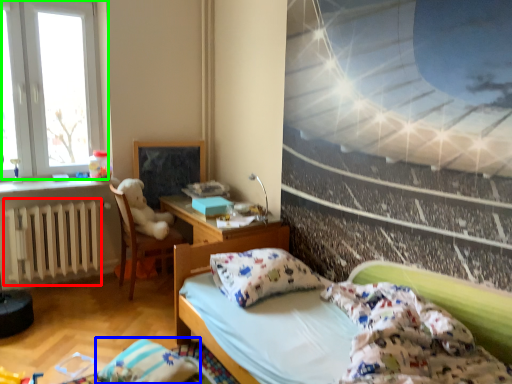
Question: Which object is the closest to the radiator (highlighted by a red box)? Choose among these: pillow (highlighted by a blue box) or window (highlighted by a green box).

Choices:
 (A) pillow
 (B) window

Answer: (B)